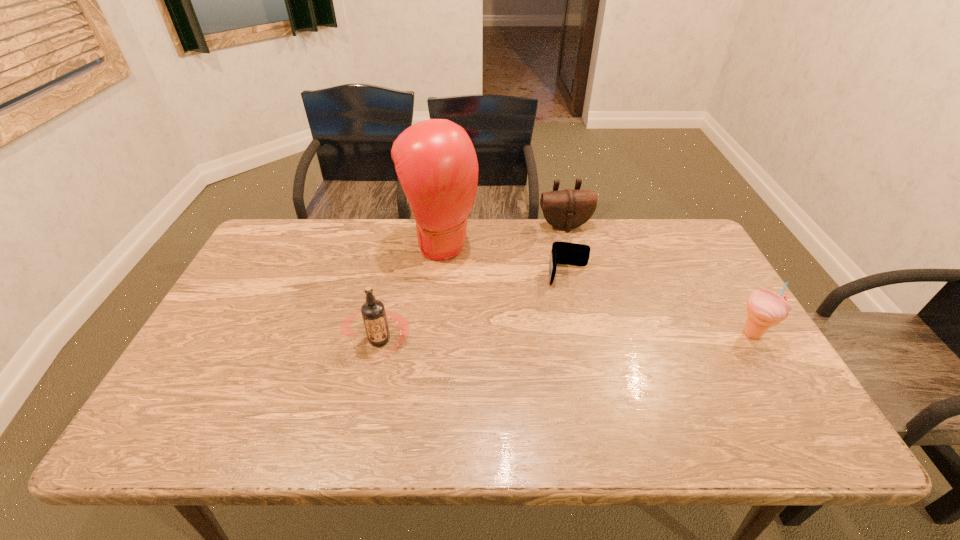
The height and width of the screenshot is (540, 960). In the image, there is a desktop. In order to click on vacant space at the far edge in this screenshot , I will do `click(529, 238)`.

This screenshot has height=540, width=960. What are the coordinates of `vacant space at the near edge` in the screenshot? It's located at (406, 406).

Locate an element on the screen. This screenshot has width=960, height=540. vacant area at the left edge of the desktop is located at coordinates 236,306.

In the image, there is a desktop. Where is `vacant space at the right edge`? vacant space at the right edge is located at coordinates (732, 321).

You are a GUI agent. You are given a task and a screenshot of the screen. Output one action in this format:
    pyautogui.click(x=<x>, y=<y>)
    Task: Click on the vacant space at the far left corner of the desktop
    Image resolution: width=960 pixels, height=540 pixels.
    Given the screenshot: What is the action you would take?
    pyautogui.click(x=309, y=223)

Locate an element on the screen. The image size is (960, 540). vacant area at the far right corner is located at coordinates click(x=645, y=219).

This screenshot has height=540, width=960. In order to click on vacant space that's between the rightmost object and the root beer in this screenshot , I will do `click(565, 336)`.

Find the location of a particular element. The image size is (960, 540). free spot between the icecream and the tallest object is located at coordinates (596, 288).

This screenshot has width=960, height=540. In order to click on vacant point located between the pouch and the rightmost object in this screenshot , I will do `click(659, 280)`.

The height and width of the screenshot is (540, 960). In order to click on free spot between the shortest object and the icecream in this screenshot , I will do `click(660, 305)`.